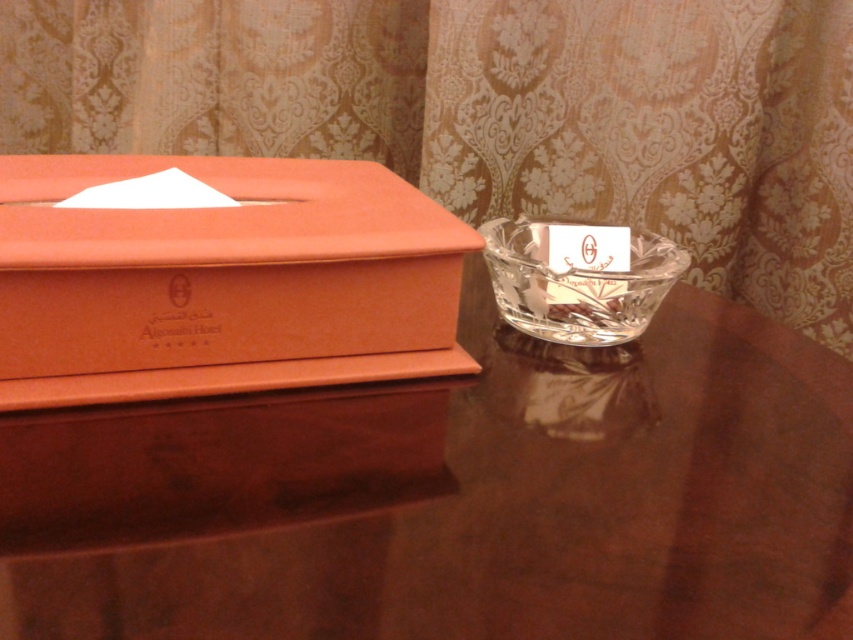
From the picture: Is brown glossy table at center thinner than clear crystal bowl at center?

Incorrect, brown glossy table at center's width is not less than clear crystal bowl at center's.

Is brown glossy table at center to the left of clear crystal bowl at center from the viewer's perspective?

Indeed, brown glossy table at center is positioned on the left side of clear crystal bowl at center.

I want to click on brown glossy table at center, so click(x=457, y=497).

Who is more distant from viewer, (167, 12) or (560, 314)?

The point (167, 12) is behind.

Who is positioned more to the right, matte gold curtain at upper center or clear crystal bowl at center?

clear crystal bowl at center

What do you see at coordinates (492, 113) in the screenshot?
I see `matte gold curtain at upper center` at bounding box center [492, 113].

Where is `matte gold curtain at upper center`? matte gold curtain at upper center is located at coordinates (492, 113).

Does matte gold curtain at upper center have a smaller size compared to orange cardboard tissue box at left?

No, matte gold curtain at upper center is not smaller than orange cardboard tissue box at left.

Locate an element on the screen. matte gold curtain at upper center is located at coordinates (492, 113).

Is point (833, 49) behind point (91, 160)?

Yes.

Locate an element on the screen. The image size is (853, 640). matte gold curtain at upper center is located at coordinates (492, 113).